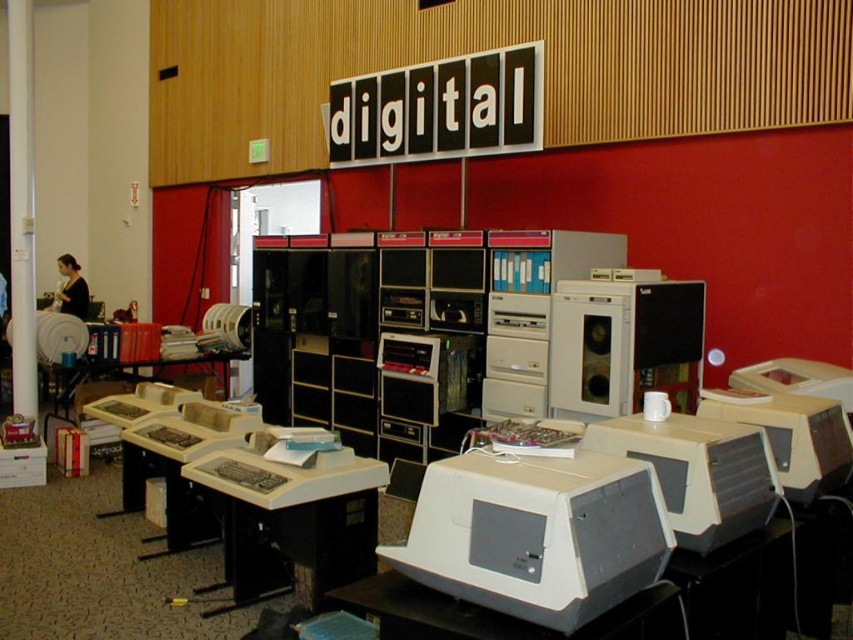
Question: Which is nearer to the matte gray desktop computer at center?

Choices:
 (A) beige plastic monitor at lower right
 (B) matte black desktop computer at center
 (C) beige plastic table at center
 (D) black plastic sign at upper center

Answer: (A)

Question: Which of the following is the closest to the observer?

Choices:
 (A) black plastic sign at upper center
 (B) matte gray desktop computer at center
 (C) matte black desktop computer at center
 (D) gray plastic monitor at center

Answer: (D)

Question: Estimate the real-world distances between objects in this image. Which object is farther from the gray plastic monitor at center?

Choices:
 (A) black plastic sign at upper center
 (B) beige plastic table at center
 (C) beige plastic monitor at lower right
 (D) matte gray desktop computer at center

Answer: (A)

Question: Can you confirm if black plastic sign at upper center is positioned to the left of matte gray desktop computer at center?

Choices:
 (A) yes
 (B) no

Answer: (A)

Question: Does gray plastic monitor at center have a greater width compared to matte gray desktop computer at center?

Choices:
 (A) yes
 (B) no

Answer: (A)

Question: In this image, where is beige plastic table at center located relative to matte gray desktop computer at center?

Choices:
 (A) right
 (B) left

Answer: (B)